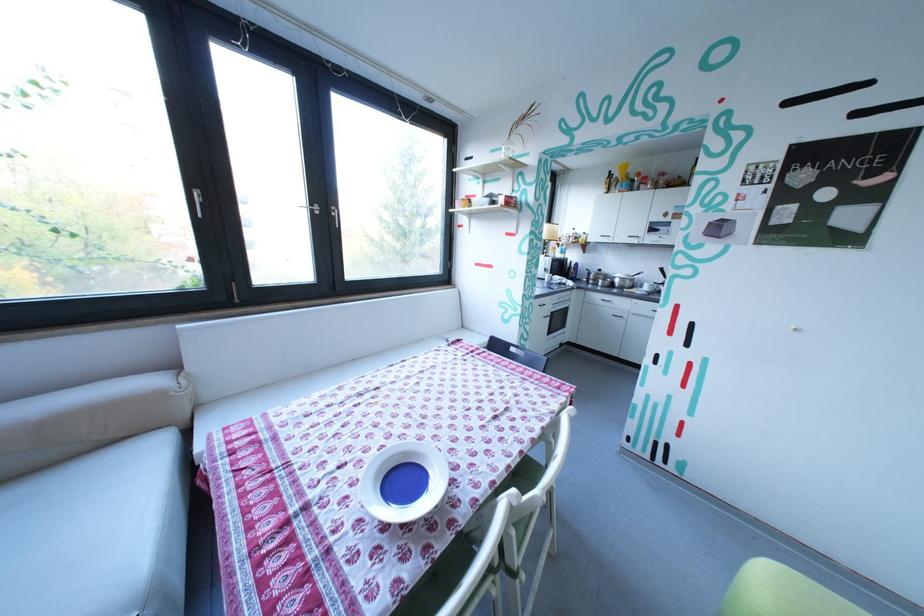
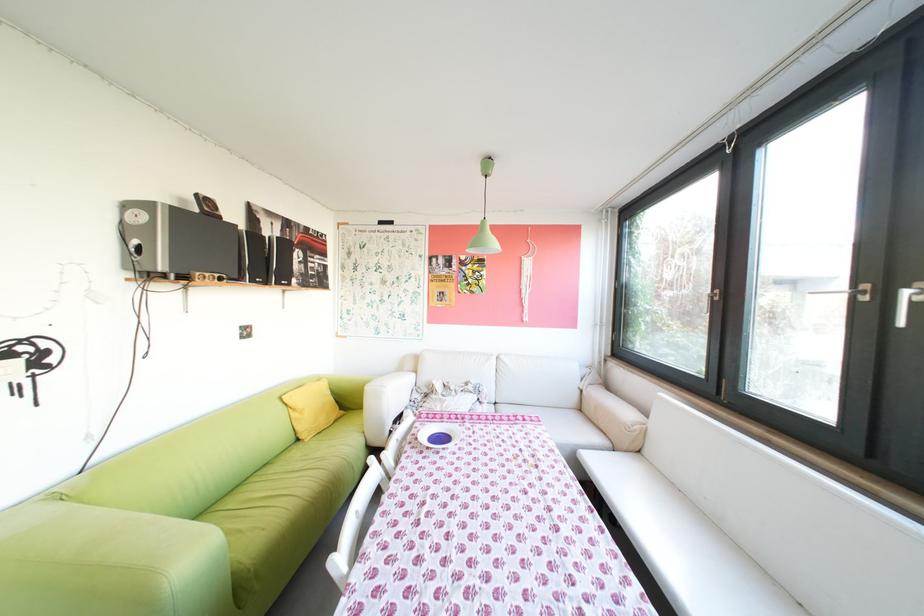
In the second image, find the point that corresponds to pixel 292 508 in the first image.

(484, 419)